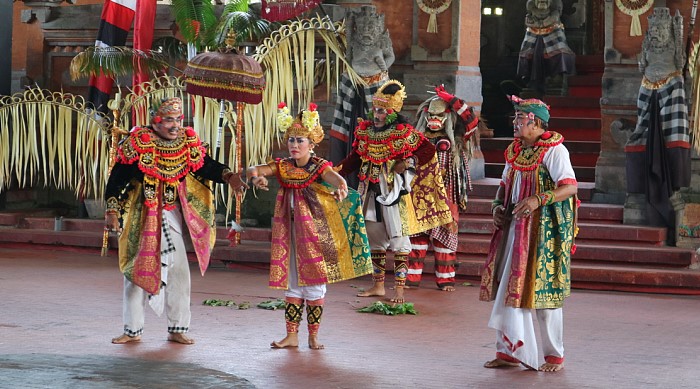
The image size is (700, 389). I want to click on wall adornments, so click(x=643, y=10), click(x=435, y=10).